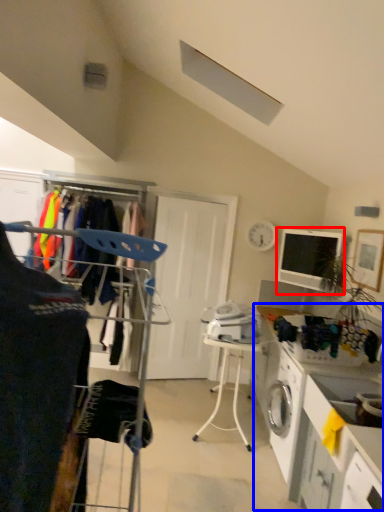
Question: Among these objects, which one is farthest to the camera, computer monitor (highlighted by a red box) or counter (highlighted by a blue box)?

Choices:
 (A) computer monitor
 (B) counter

Answer: (A)